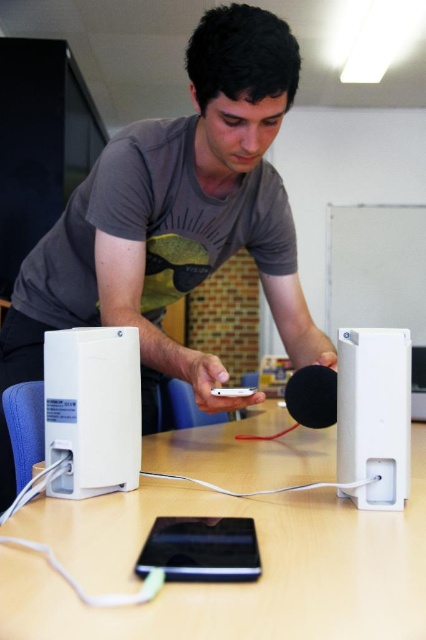
Is white matte speaker at center to the left of black matte/ipod at center from the viewer's perspective?

No, white matte speaker at center is not to the left of black matte/ipod at center.

Is point (356, 349) less distant than point (233, 577)?

No, (356, 349) is further to viewer.

Identify the location of white matte speaker at center. (374, 416).

Is black matte/ipod at center to the right of satin silver ipod at center from the viewer's perspective?

Result: No, black matte/ipod at center is not to the right of satin silver ipod at center.

I want to click on black matte/ipod at center, so click(201, 548).

Is point (184, 579) behind point (245, 394)?

No, (184, 579) is in front of (245, 394).

Identify the location of black matte/ipod at center. (201, 548).

Between white plastic table at center and satin silver ipod at center, which one appears on the left side from the viewer's perspective?

From the viewer's perspective, satin silver ipod at center appears more on the left side.

This screenshot has height=640, width=426. In order to click on white plastic table at center in this screenshot , I will do `click(224, 584)`.